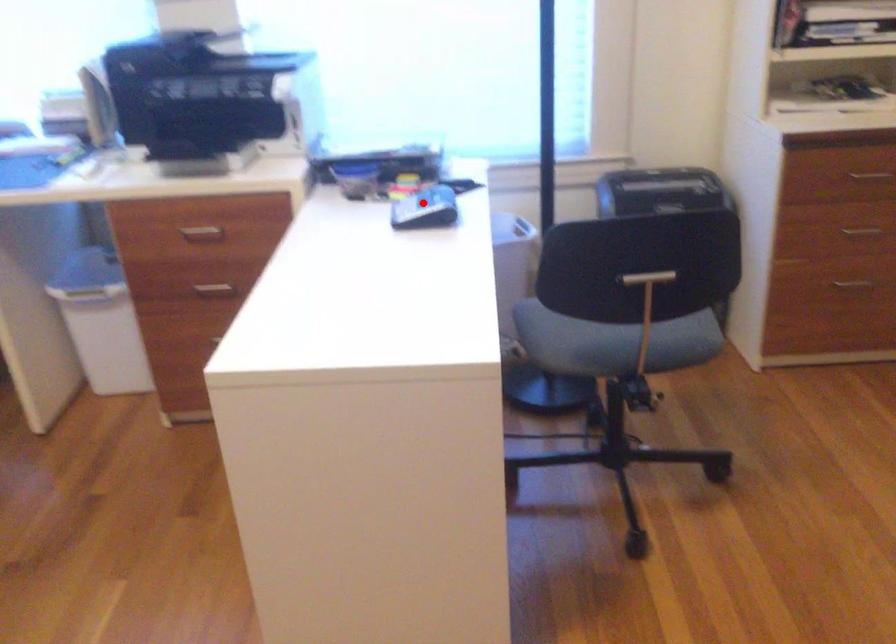
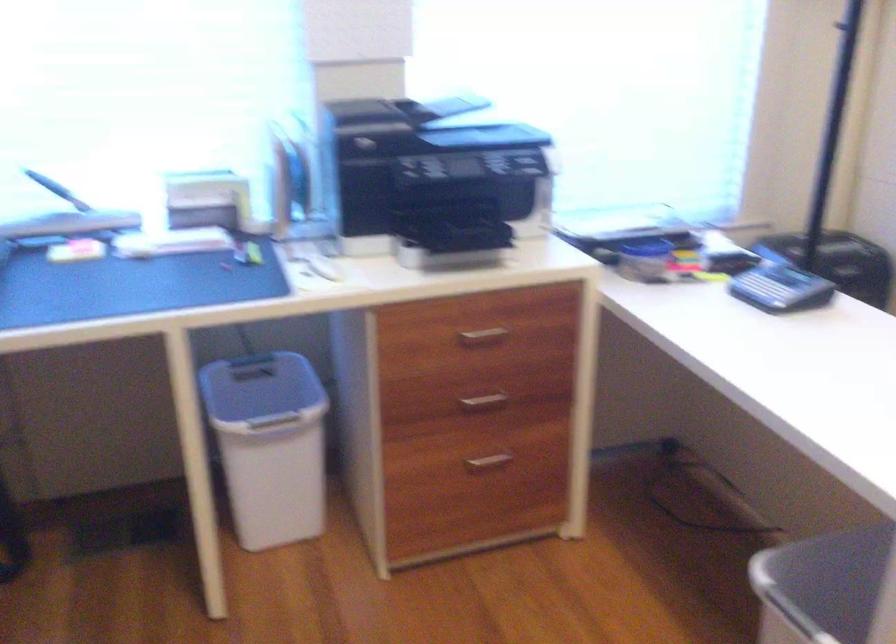
Question: I am providing you with two images of the same scene from different viewpoints. A red point is shown in image1. For the corresponding object point in image2, is it positioned nearer or farther from the camera?

Choices:
 (A) Nearer
 (B) Farther

Answer: (A)